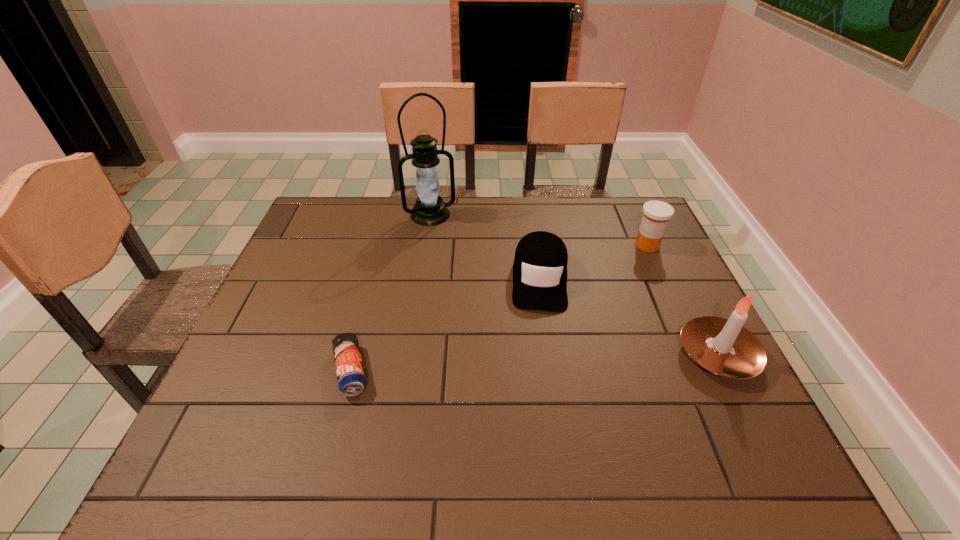
Locate an element on the screen. The image size is (960, 540). beer can that is at the near edge is located at coordinates (351, 379).

You are a GUI agent. You are given a task and a screenshot of the screen. Output one action in this format:
    pyautogui.click(x=<x>, y=<y>)
    Task: Click on the candle situated at the near edge
    This screenshot has height=540, width=960.
    Given the screenshot: What is the action you would take?
    pyautogui.click(x=724, y=347)

Image resolution: width=960 pixels, height=540 pixels. What are the coordinates of `candle located at the right edge` in the screenshot? It's located at (724, 347).

Where is `medicine that is at the right edge`? The image size is (960, 540). medicine that is at the right edge is located at coordinates (656, 214).

Locate an element on the screen. Image resolution: width=960 pixels, height=540 pixels. object located in the far right corner section of the desktop is located at coordinates (656, 214).

This screenshot has height=540, width=960. In order to click on object positioned at the near right corner in this screenshot , I will do `click(724, 347)`.

You are a GUI agent. You are given a task and a screenshot of the screen. Output one action in this format:
    pyautogui.click(x=<x>, y=<y>)
    Task: Click on the free space at the far edge
    Image resolution: width=960 pixels, height=540 pixels.
    Given the screenshot: What is the action you would take?
    pyautogui.click(x=407, y=197)

In order to click on free space at the near edge of the desktop in this screenshot , I will do `click(419, 426)`.

Where is `free space at the left edge`? free space at the left edge is located at coordinates (314, 244).

Locate an element on the screen. This screenshot has height=540, width=960. vacant region at the right edge of the desktop is located at coordinates (684, 287).